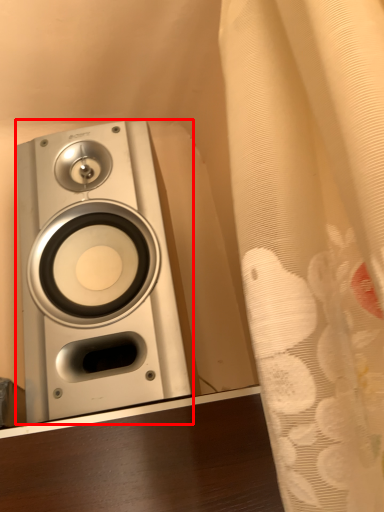
Question: Considering the relative positions of home appliance (annotated by the red box) and curtain in the image provided, where is home appliance (annotated by the red box) located with respect to the staircase?

Choices:
 (A) right
 (B) left

Answer: (B)